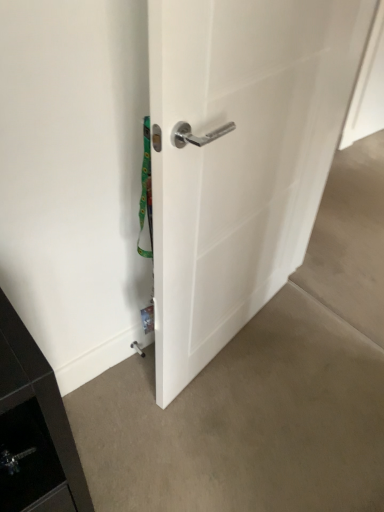
Question: Is white glossy door handle at center shorter than light brown carpet at lower center, which appears as the 2th concrete when viewed from the top?

Choices:
 (A) no
 (B) yes

Answer: (A)

Question: Is white glossy door handle at center facing away from light brown carpet at lower center, which appears as the 2th concrete when viewed from the top?

Choices:
 (A) no
 (B) yes

Answer: (A)

Question: From a real-world perspective, is white glossy door handle at center under light brown carpet at lower center, which is the first concrete in bottom-to-top order?

Choices:
 (A) yes
 (B) no

Answer: (B)

Question: Is white glossy door handle at center not inside light brown carpet at lower center, which is the first concrete in bottom-to-top order?

Choices:
 (A) yes
 (B) no

Answer: (A)

Question: From the image's perspective, would you say white glossy door handle at center is positioned over light brown carpet at lower center, which appears as the 2th concrete when viewed from the top?

Choices:
 (A) no
 (B) yes

Answer: (B)

Question: From the image's perspective, is white glossy door handle at center located above or below light brown carpet at lower center, which is the first concrete in bottom-to-top order?

Choices:
 (A) above
 (B) below

Answer: (A)

Question: Relative to light brown carpet at lower center, which is the first concrete in bottom-to-top order, is white glossy door handle at center in front or behind?

Choices:
 (A) front
 (B) behind

Answer: (A)

Question: Would you say white glossy door handle at center is inside or outside light brown carpet at lower center, which appears as the 2th concrete when viewed from the top?

Choices:
 (A) outside
 (B) inside

Answer: (A)

Question: Visually, is white glossy door handle at center positioned to the left or to the right of light brown carpet at lower center, which appears as the 2th concrete when viewed from the top?

Choices:
 (A) left
 (B) right

Answer: (B)

Question: From the image's perspective, is smooth concrete floor at lower right, the 1th concrete in the top-to-bottom sequence, positioned above or below light brown carpet at lower center, which appears as the 2th concrete when viewed from the top?

Choices:
 (A) below
 (B) above

Answer: (B)

Question: From a real-world perspective, is smooth concrete floor at lower right, the 2th concrete ordered from the bottom, physically located above or below light brown carpet at lower center, which appears as the 2th concrete when viewed from the top?

Choices:
 (A) above
 (B) below

Answer: (A)

Question: Considering the positions of point (367, 231) and point (137, 430), is point (367, 231) closer or farther from the camera than point (137, 430)?

Choices:
 (A) farther
 (B) closer

Answer: (A)

Question: Is smooth concrete floor at lower right, the 2th concrete ordered from the bottom, wider or thinner than light brown carpet at lower center, which is the first concrete in bottom-to-top order?

Choices:
 (A) wide
 (B) thin

Answer: (B)

Question: Is light brown carpet at lower center, which is the first concrete in bottom-to-top order, inside or outside of white glossy door handle at center?

Choices:
 (A) outside
 (B) inside

Answer: (A)

Question: Is light brown carpet at lower center, which is the first concrete in bottom-to-top order, to the left or to the right of white glossy door handle at center in the image?

Choices:
 (A) right
 (B) left

Answer: (B)